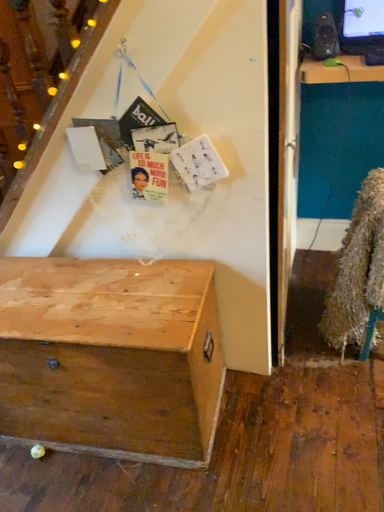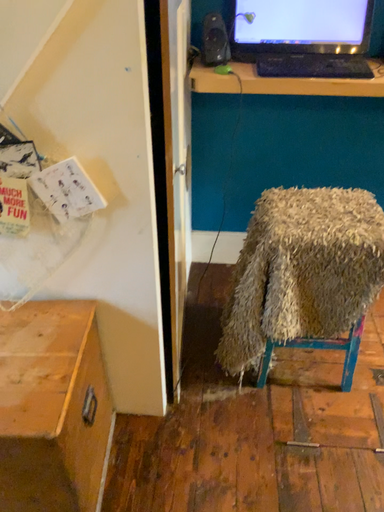
Question: Which way did the camera rotate in the video?

Choices:
 (A) rotated left
 (B) rotated right

Answer: (B)